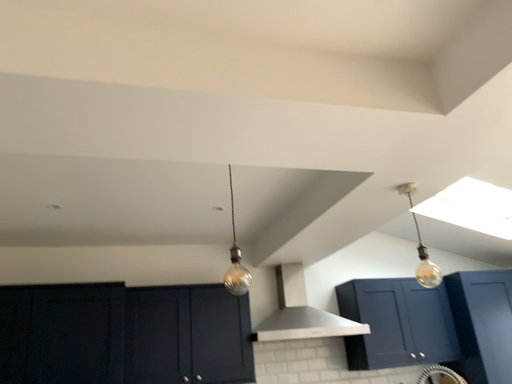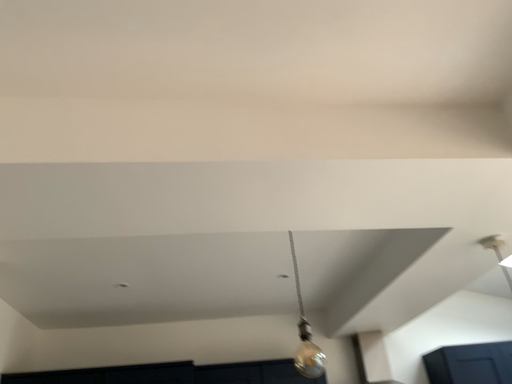
Question: How did the camera likely rotate when shooting the video?

Choices:
 (A) rotated downward
 (B) rotated upward

Answer: (B)